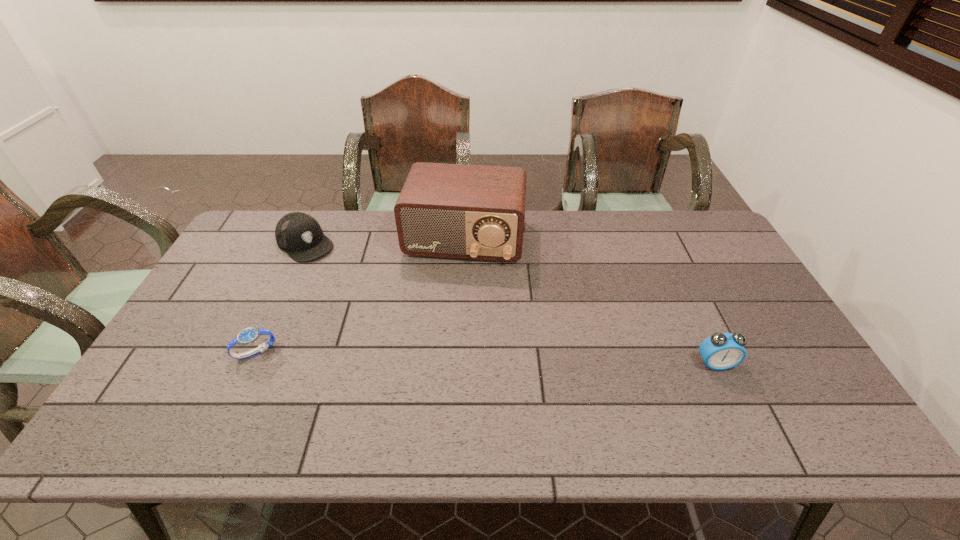
You are a GUI agent. You are given a task and a screenshot of the screen. Output one action in this format:
    pyautogui.click(x=<x>, y=<y>)
    Task: Click on the watch
    The width and height of the screenshot is (960, 540).
    Given the screenshot: What is the action you would take?
    pyautogui.click(x=249, y=335)

Find the location of `the rightmost object`. the rightmost object is located at coordinates (721, 351).

You are a GUI agent. You are given a task and a screenshot of the screen. Output one action in this format:
    pyautogui.click(x=<x>, y=<y>)
    Task: Click on the cap
    The image size is (960, 540).
    Given the screenshot: What is the action you would take?
    pyautogui.click(x=298, y=234)

This screenshot has height=540, width=960. Identify the location of radio receiver. (462, 211).

The width and height of the screenshot is (960, 540). Find the location of `the tallest object`. the tallest object is located at coordinates (462, 211).

The height and width of the screenshot is (540, 960). Find the location of `vacant point located 0.220m on the right of the shortest object`. vacant point located 0.220m on the right of the shortest object is located at coordinates (360, 352).

Find the location of a particular element. This screenshot has width=960, height=540. vacant space located on the face of the alarm clock is located at coordinates (727, 388).

Where is `free region located on the front-facing side of the cap`? free region located on the front-facing side of the cap is located at coordinates (328, 267).

Locate an element on the screen. The image size is (960, 540). free space located on the front-facing side of the cap is located at coordinates (342, 280).

Identify the location of vacant region located on the front-facing side of the cap. This screenshot has width=960, height=540. (353, 292).